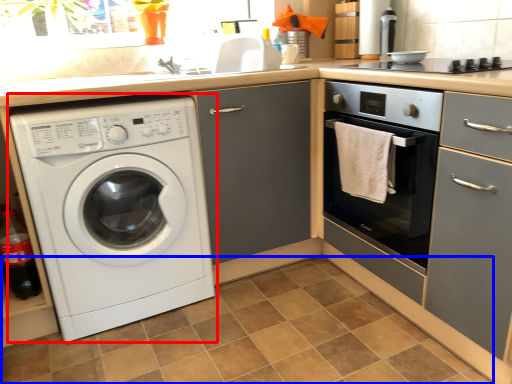
Question: Which of the following is the farthest to the observer, washing machine (highlighted by a red box) or tile (highlighted by a blue box)?

Choices:
 (A) washing machine
 (B) tile

Answer: (A)